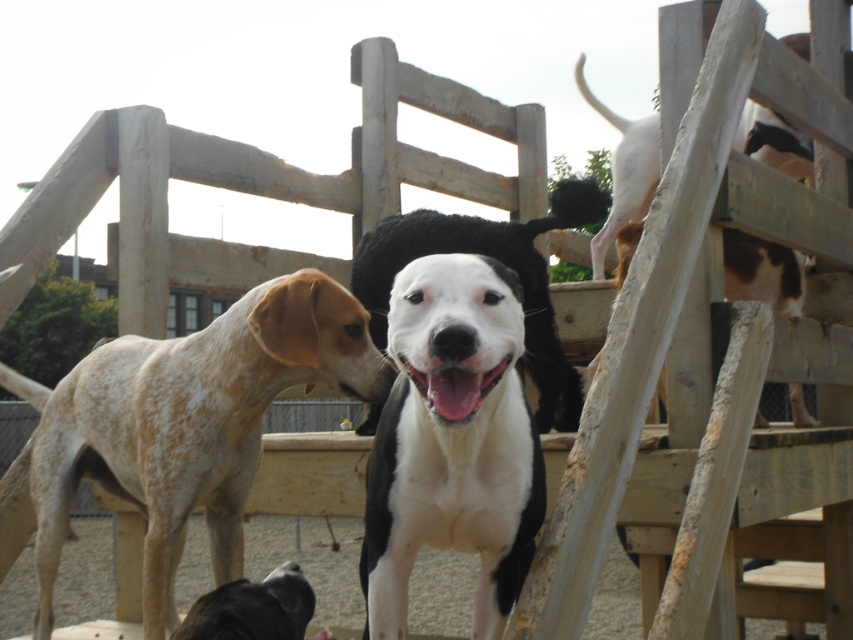
Who is higher up, white/black fur dog at center or black fur dog at lower center?

white/black fur dog at center is higher up.

Is white/black fur dog at center closer to the viewer compared to black fur dog at lower center?

That is False.

Which is in front, point (529, 280) or point (219, 596)?

Positioned in front is point (219, 596).

Locate an element on the screen. white/black fur dog at center is located at coordinates (502, 262).

Which of these two, speckled fur dog at left or white smooth dog at center, stands taller?

white smooth dog at center is taller.

Which is behind, point (215, 554) or point (465, 548)?

The point (215, 554) is more distant.

The image size is (853, 640). Find the location of `speckled fur dog at left`. speckled fur dog at left is located at coordinates (178, 428).

This screenshot has width=853, height=640. Describe the element at coordinates (178, 428) in the screenshot. I see `speckled fur dog at left` at that location.

Can you confirm if speckled fur dog at left is taller than white/black fur dog at center?

Yes, speckled fur dog at left is taller than white/black fur dog at center.

Is point (334, 371) farther from camera compared to point (473, 221)?

No.

At what (x,y) coordinates should I click in order to perform the action: click on speckled fur dog at left. Please return your answer as a coordinate pair (x, y). Looking at the image, I should click on (178, 428).